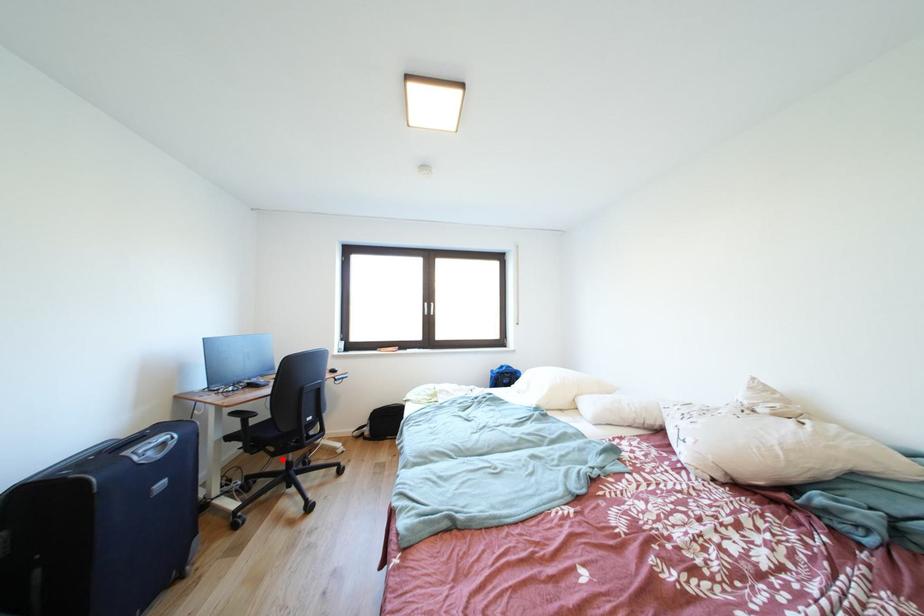
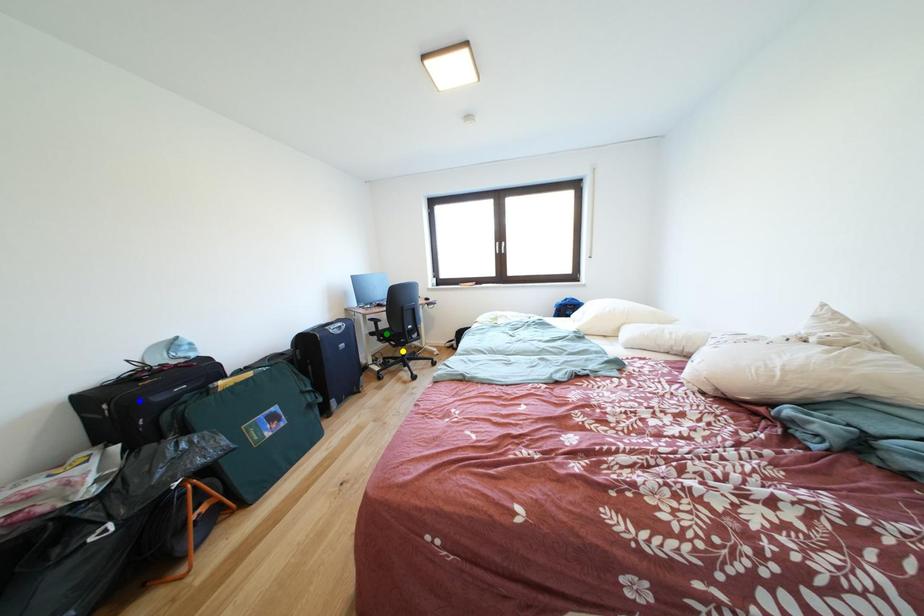
Question: I am providing you with two images of the same scene from different viewpoints. A red point is marked on the first image. You are given multiple points on the second image. Which point in image 2 is actually the same real-world point as the red point in image 1?

Choices:
 (A) green point
 (B) yellow point
 (C) blue point

Answer: (B)